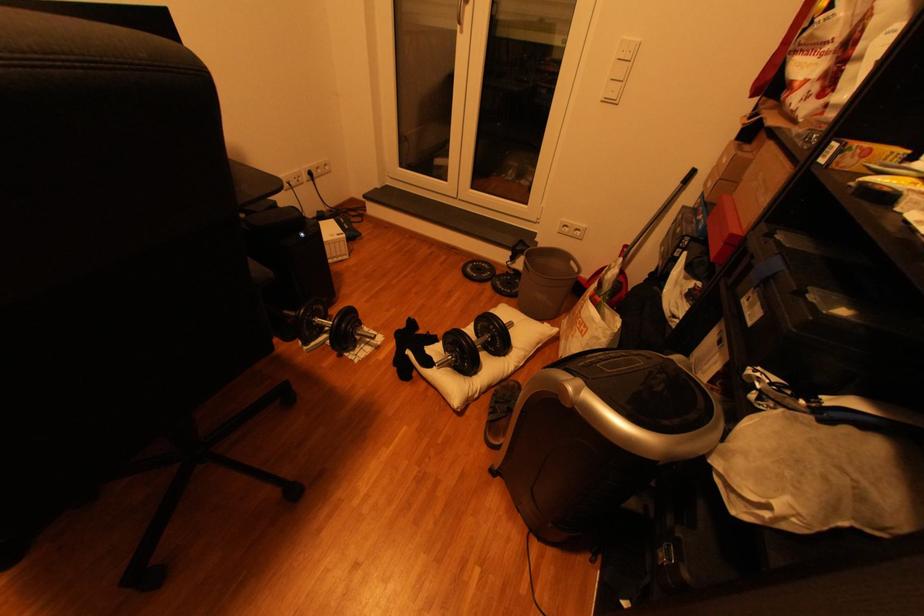
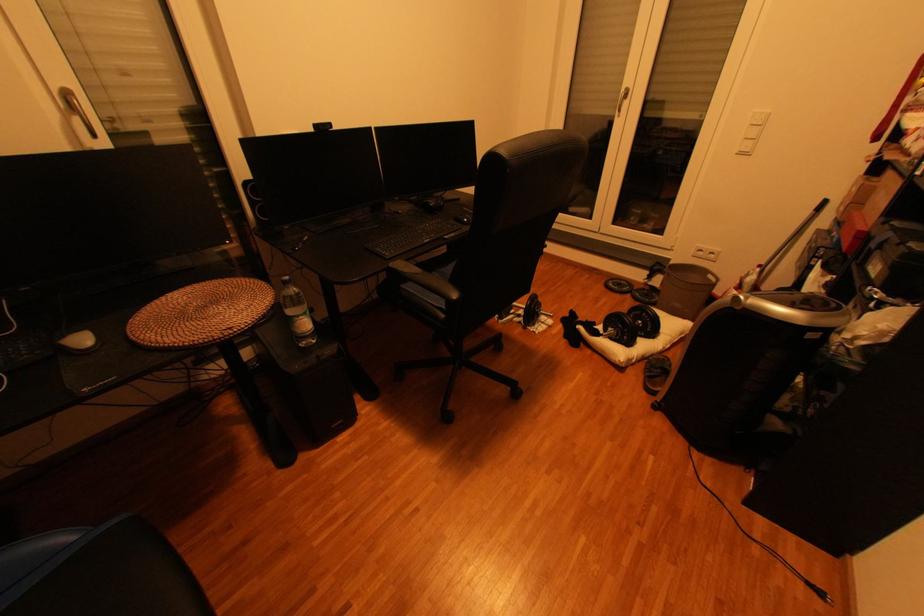
The point at [394,342] is marked in the first image. Where is the corresponding point in the second image?

(564, 323)